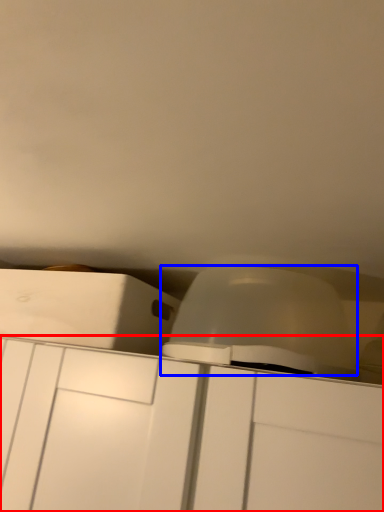
Question: Which of the following is the closest to the observer, cabinetry (highlighted by a red box) or lift (highlighted by a blue box)?

Choices:
 (A) cabinetry
 (B) lift

Answer: (A)